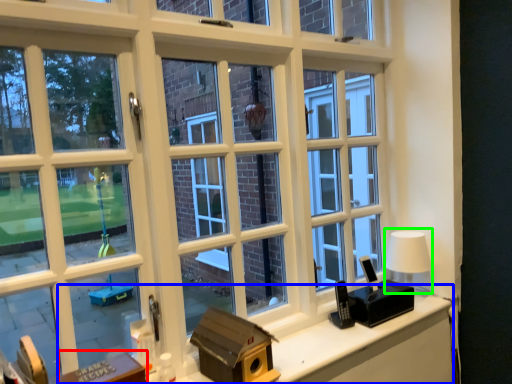
Question: Which is farther away from table (highlighted by a red box)? computer desk (highlighted by a blue box) or table lamp (highlighted by a green box)?

Choices:
 (A) computer desk
 (B) table lamp

Answer: (B)